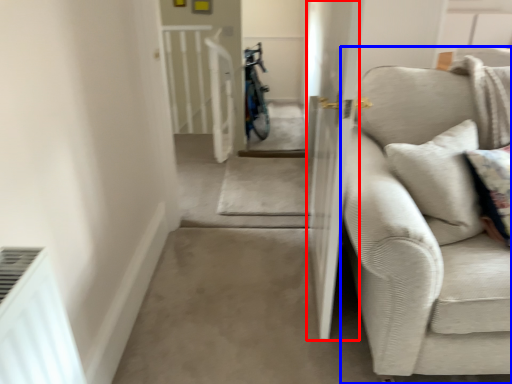
Question: Which object appears closest to the camera in this image, screen door (highlighted by a red box) or studio couch (highlighted by a blue box)?

Choices:
 (A) screen door
 (B) studio couch

Answer: (B)